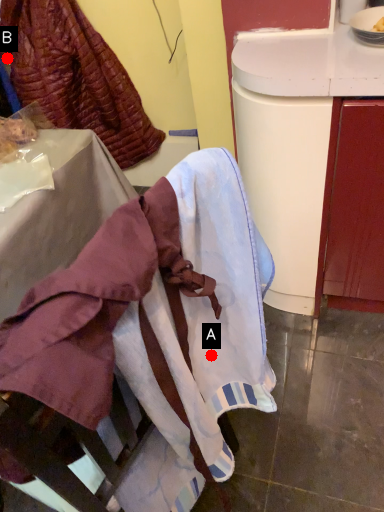
Question: Two points are circled on the image, labeled by A and B beside each circle. Which point is further to the camera?

Choices:
 (A) A is further
 (B) B is further

Answer: (B)